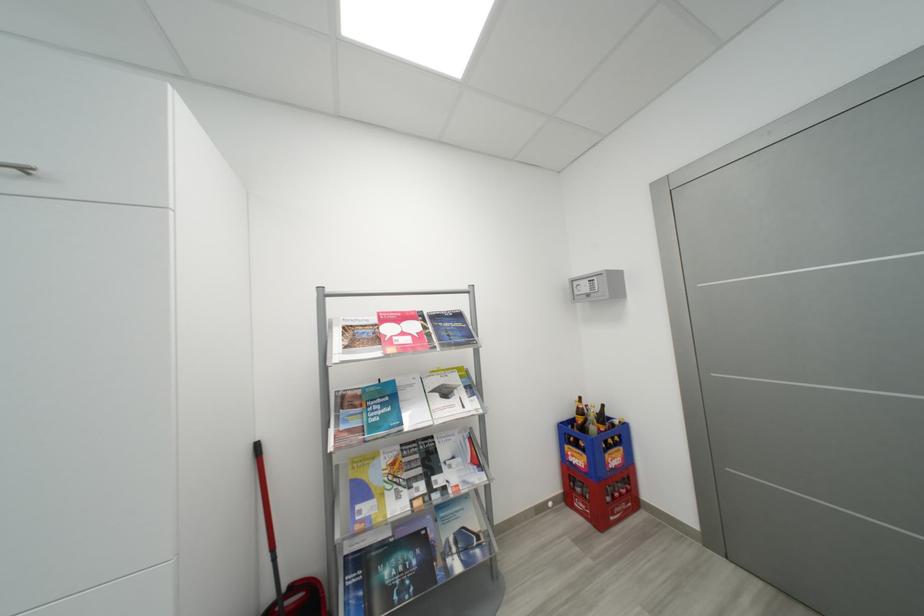
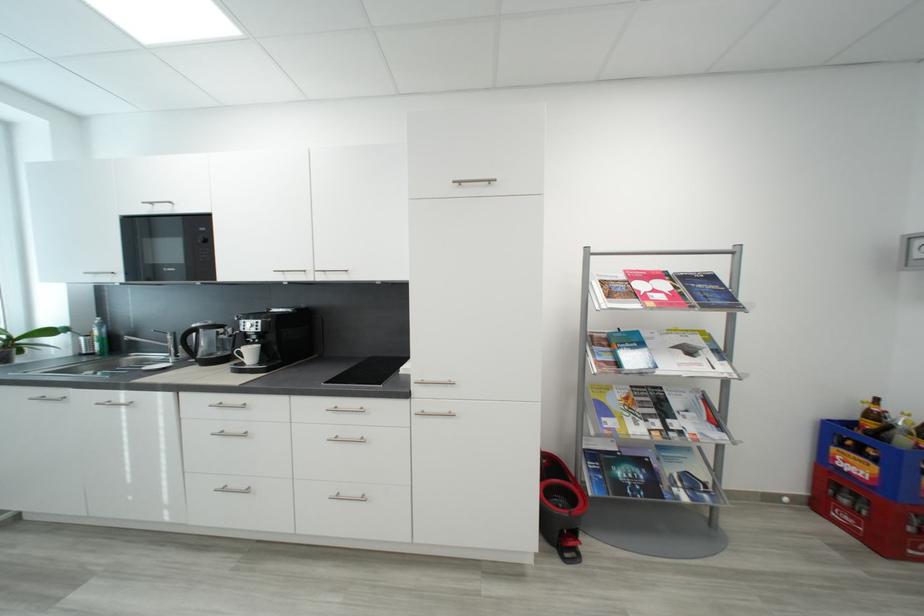
Where in the second image is the point corresponding to point 584,447 from the first image?

(867, 454)